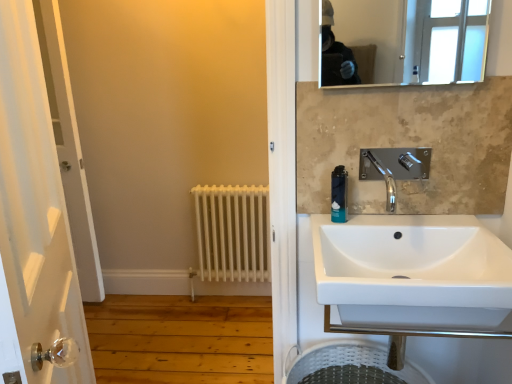
Question: Does white matte radiator at lower left contain clear glass mirror at upper center?

Choices:
 (A) yes
 (B) no

Answer: (B)

Question: Does white matte radiator at lower left lie in front of clear glass mirror at upper center?

Choices:
 (A) no
 (B) yes

Answer: (A)

Question: Is white matte radiator at lower left oriented towards clear glass mirror at upper center?

Choices:
 (A) yes
 (B) no

Answer: (B)

Question: From the image's perspective, is white matte radiator at lower left above clear glass mirror at upper center?

Choices:
 (A) yes
 (B) no

Answer: (B)

Question: Is the surface of white matte radiator at lower left in direct contact with clear glass mirror at upper center?

Choices:
 (A) no
 (B) yes

Answer: (A)

Question: From a real-world perspective, is white matte radiator at lower left under clear glass mirror at upper center?

Choices:
 (A) yes
 (B) no

Answer: (A)

Question: Considering the relative sizes of white ceramic sink at center and chrome metallic faucet at upper right in the image provided, is white ceramic sink at center taller than chrome metallic faucet at upper right?

Choices:
 (A) yes
 (B) no

Answer: (A)

Question: From a real-world perspective, does white ceramic sink at center sit lower than chrome metallic faucet at upper right?

Choices:
 (A) yes
 (B) no

Answer: (A)

Question: Is the surface of white ceramic sink at center in direct contact with chrome metallic faucet at upper right?

Choices:
 (A) yes
 (B) no

Answer: (B)

Question: From the image's perspective, would you say white ceramic sink at center is positioned over chrome metallic faucet at upper right?

Choices:
 (A) no
 (B) yes

Answer: (A)

Question: From a real-world perspective, is white ceramic sink at center physically above chrome metallic faucet at upper right?

Choices:
 (A) yes
 (B) no

Answer: (B)

Question: Is white ceramic sink at center thinner than chrome metallic faucet at upper right?

Choices:
 (A) yes
 (B) no

Answer: (B)

Question: Does clear glass mirror at upper center lie behind white ceramic sink at center?

Choices:
 (A) no
 (B) yes

Answer: (B)